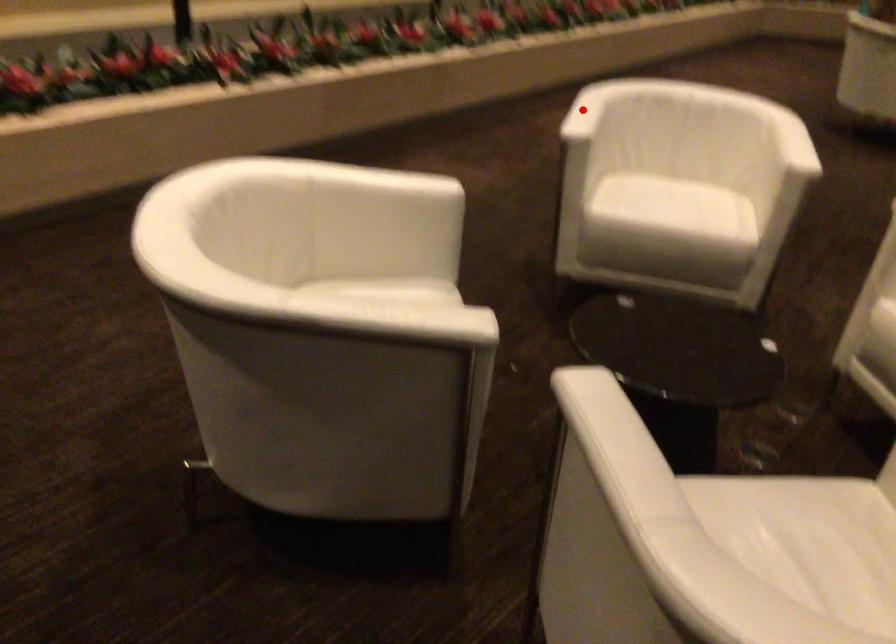
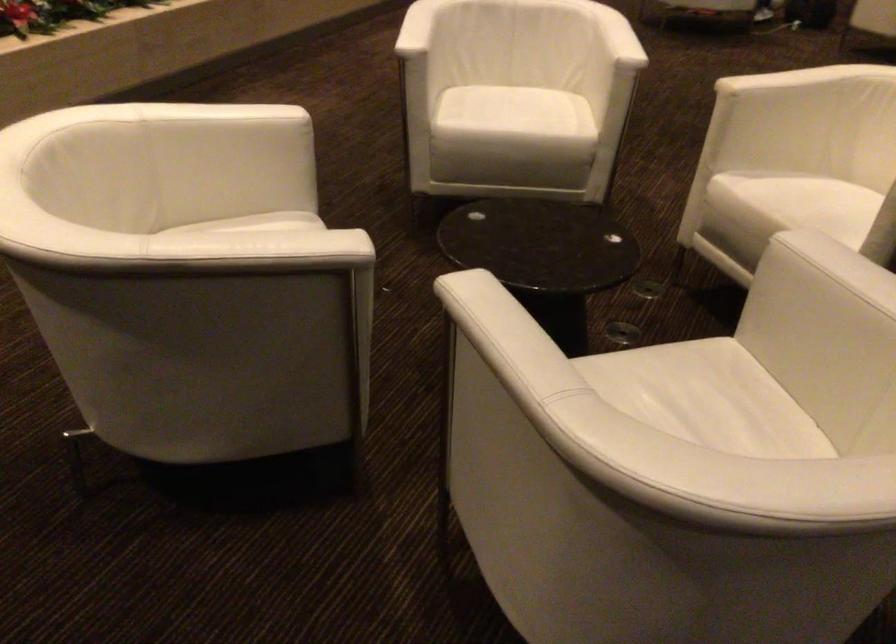
Locate, in the second image, the point that corresponds to the highlighted location in the first image.

(417, 28)